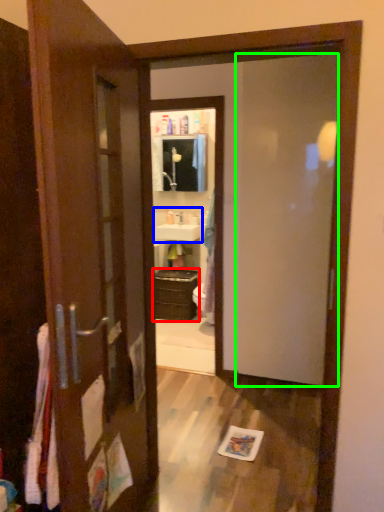
Question: Based on their relative distances, which object is nearer to cabinetry (highlighted by a red box)? Choose from sink (highlighted by a blue box) and screen door (highlighted by a green box).

Choices:
 (A) sink
 (B) screen door

Answer: (A)